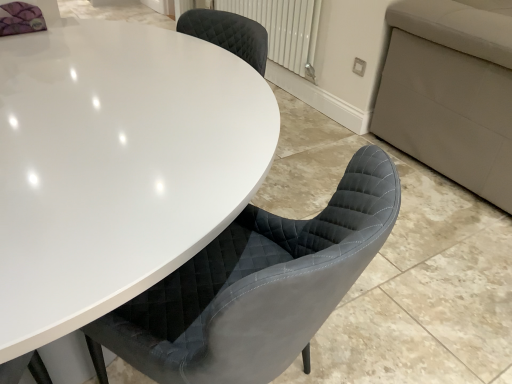
Question: From the image's perspective, is white textured radiator at upper center above or below white glossy table at center?

Choices:
 (A) below
 (B) above

Answer: (B)

Question: From a real-world perspective, is white textured radiator at upper center positioned above or below white glossy table at center?

Choices:
 (A) above
 (B) below

Answer: (A)

Question: Which is correct: white textured radiator at upper center is inside white glossy table at center, or outside of it?

Choices:
 (A) inside
 (B) outside

Answer: (B)

Question: From the image's perspective, relative to white textured radiator at upper center, is white glossy table at center above or below?

Choices:
 (A) below
 (B) above

Answer: (A)

Question: From a real-world perspective, is white glossy table at center above or below white textured radiator at upper center?

Choices:
 (A) above
 (B) below

Answer: (B)

Question: Considering the positions of white glossy table at center and white textured radiator at upper center in the image, is white glossy table at center bigger or smaller than white textured radiator at upper center?

Choices:
 (A) big
 (B) small

Answer: (A)

Question: Is white glossy table at center in front of or behind white textured radiator at upper center in the image?

Choices:
 (A) front
 (B) behind

Answer: (A)